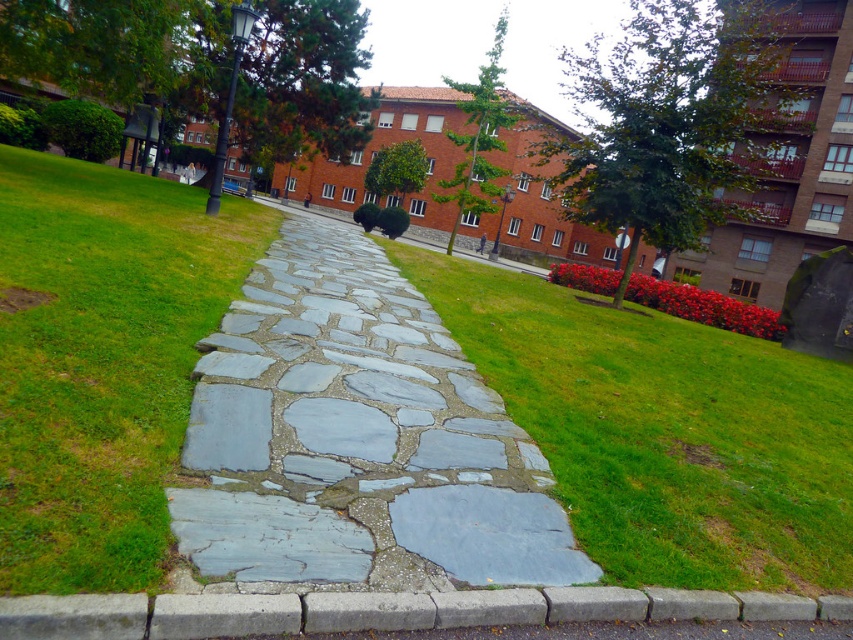
You are a delivery person carrying a heavy box and need to step from the gray stone path at center onto the gray concrete curb at lower center. Considering their heights, will you need to climb up or step down?

The gray stone path at center is taller than the gray concrete curb at lower center, so you will need to step down onto the curb.

You are a gardener who needs to water the grass between the gray stone path at center and the gray concrete curb at lower center. The watering hose can reach 3 meters. Will you be able to water the entire area without moving the hose?

The gray stone path at center is 3.45 meters from the gray concrete curb at lower center. Since the hose can only reach 3 meters, you will not be able to water the entire area without moving the hose.

You are a gardener who needs to place a heavy potted plant between the gray stone path at center and the gray concrete curb at lower center. According to the scene description, which object should the potted plant be placed closer to in order to avoid blocking the path?

The gray stone path at center is above the gray concrete curb at lower center. To avoid blocking the path, the potted plant should be placed closer to the gray concrete curb at lower center.